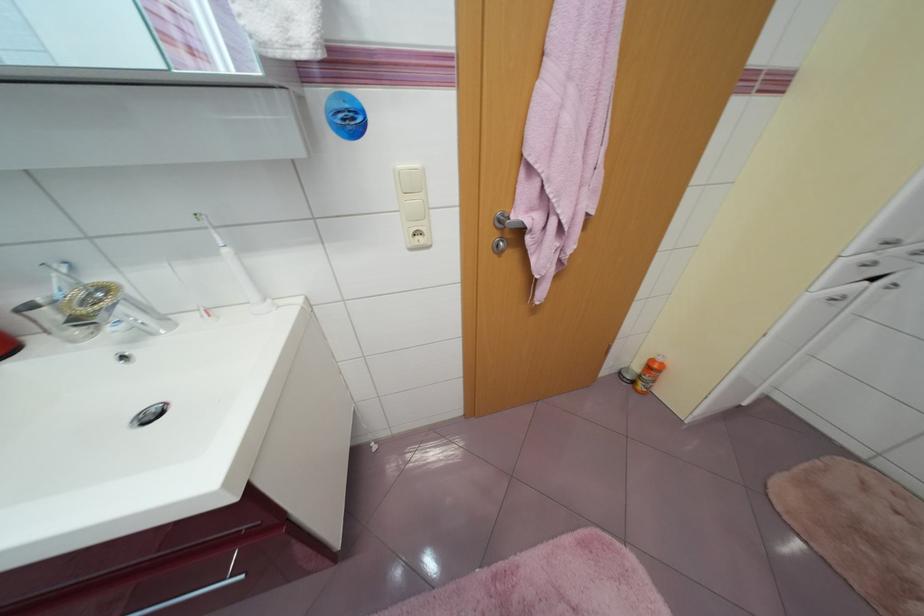
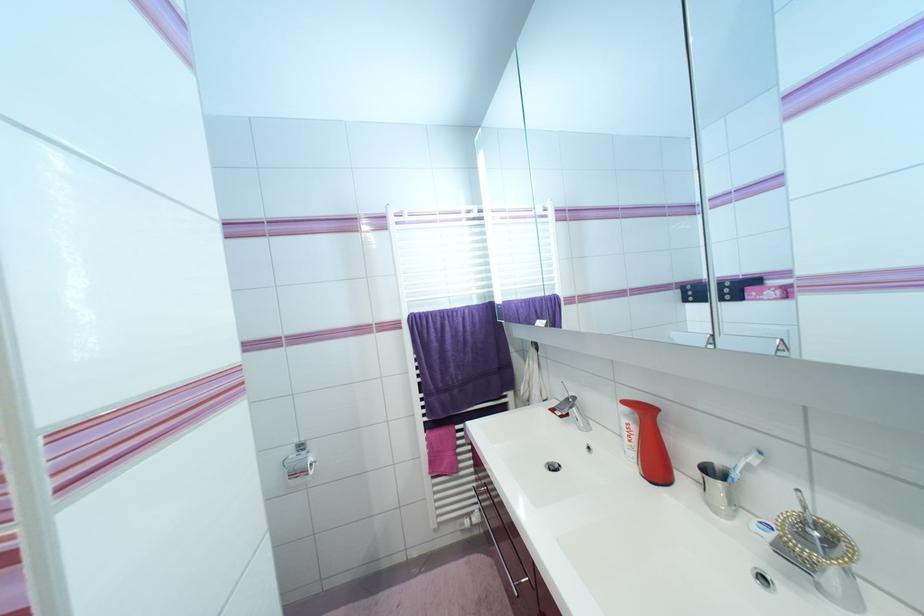
Question: The first image is from the beginning of the video and the second image is from the end. How did the camera likely rotate when shooting the video?

Choices:
 (A) Left
 (B) Right
 (C) Up
 (D) Down

Answer: (A)